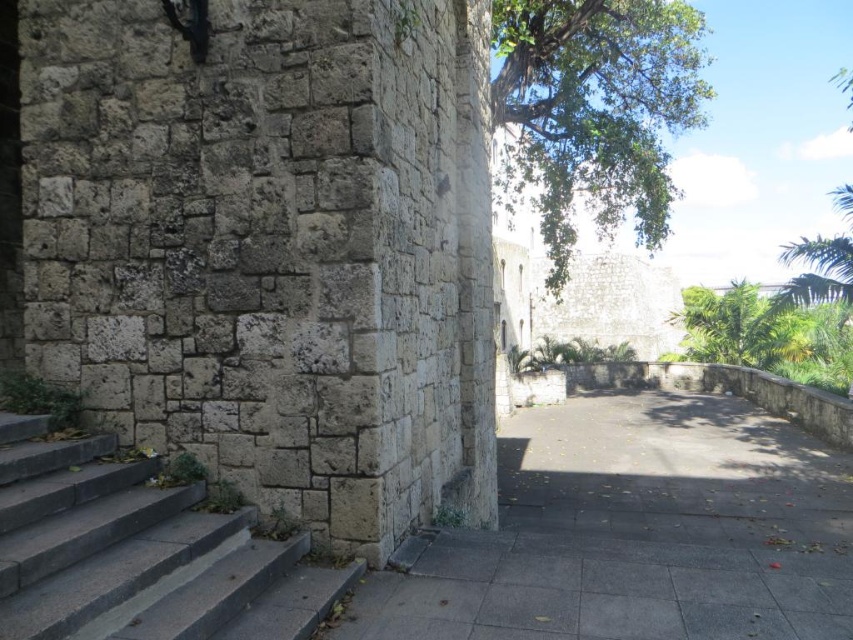
Between gray concrete stairs at lower left and green leafy tree at upper center, which one is positioned higher?

green leafy tree at upper center is above.

Does gray concrete stairs at lower left have a greater height compared to green leafy tree at upper center?

No.

Does point (73, 561) come farther from viewer compared to point (584, 68)?

No, it is not.

Identify the location of gray concrete stairs at lower left. The width and height of the screenshot is (853, 640). (138, 552).

Looking at this image, can you confirm if gray concrete pavement at lower center is smaller than green leafy tree at upper center?

Yes, gray concrete pavement at lower center is smaller than green leafy tree at upper center.

Which is in front, point (515, 465) or point (514, 156)?

Point (515, 465) is in front.

Image resolution: width=853 pixels, height=640 pixels. Describe the element at coordinates (634, 532) in the screenshot. I see `gray concrete pavement at lower center` at that location.

Locate an element on the screen. The image size is (853, 640). gray concrete pavement at lower center is located at coordinates (634, 532).

Who is positioned more to the left, green leafy tree at upper center or green leafy tree at right?

green leafy tree at upper center

Is green leafy tree at upper center shorter than green leafy tree at right?

Incorrect, green leafy tree at upper center's height does not fall short of green leafy tree at right's.

In order to click on green leafy tree at upper center in this screenshot , I will do `click(595, 109)`.